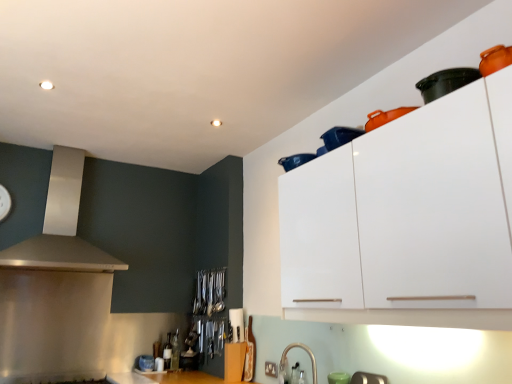
This screenshot has height=384, width=512. I want to click on metallic silver gas stove at lower left, so click(58, 378).

Measure the distance between point (316, 371) and camera.

The distance of point (316, 371) from camera is 2.32 meters.

Where is `polished stainless steel cutlery at center`? polished stainless steel cutlery at center is located at coordinates (209, 292).

What is the approximate height of satin silver vent at upper left?

satin silver vent at upper left is 35.42 inches tall.

Identify the location of white plastic knife block at center, arranged as the first appliance when ordered from the bottom. (237, 324).

At what (x,y) coordinates should I click in order to perform the action: click on metallic silver gas stove at lower left. Please return your answer as a coordinate pair (x, y). The width and height of the screenshot is (512, 384). Looking at the image, I should click on (58, 378).

Is point (281, 360) more distant than point (364, 131)?

Yes.

Which object is wider, satin nickel faucet at lower center, the second appliance positioned from the back, or blue plastic container at upper center, marked as the third appliance in a left-to-right arrangement?

blue plastic container at upper center, marked as the third appliance in a left-to-right arrangement.

Is satin nickel faucet at lower center, the 2th appliance in the top-to-bottom sequence, with blue plastic container at upper center, which is the first appliance in right-to-left order?

No, satin nickel faucet at lower center, the 2th appliance in the top-to-bottom sequence, is not in contact with blue plastic container at upper center, which is the first appliance in right-to-left order.

Consider the image. From the image's perspective, is satin nickel faucet at lower center, which is counted as the second appliance, starting from the left, located above or below blue plastic container at upper center, which is the first appliance in right-to-left order?

Based on their image positions, satin nickel faucet at lower center, which is counted as the second appliance, starting from the left, is located beneath blue plastic container at upper center, which is the first appliance in right-to-left order.

Is satin nickel faucet at lower center, the second appliance positioned from the back, far away from white glossy cabinet at upper right?

Indeed, satin nickel faucet at lower center, the second appliance positioned from the back, is not near white glossy cabinet at upper right.

From a real-world perspective, who is located lower, satin nickel faucet at lower center, the second appliance when ordered from right to left, or white glossy cabinet at upper right?

In real-world perspective, satin nickel faucet at lower center, the second appliance when ordered from right to left, is lower.

Which object is further away from the camera, satin nickel faucet at lower center, the second appliance positioned from the back, or white glossy cabinet at upper right?

Positioned behind is satin nickel faucet at lower center, the second appliance positioned from the back.

Where is `appliance that is the 2nd one when counting backward from the white glossy cabinet at upper right`? Image resolution: width=512 pixels, height=384 pixels. appliance that is the 2nd one when counting backward from the white glossy cabinet at upper right is located at coordinates (308, 354).

How many degrees apart are the facing directions of white glossy cabinet at upper right and satin silver vent at upper left?

89.8 degrees separate the facing orientations of white glossy cabinet at upper right and satin silver vent at upper left.

Is white glossy cabinet at upper right oriented away from satin silver vent at upper left?

No, white glossy cabinet at upper right is not facing away from satin silver vent at upper left.

Considering the relative sizes of white glossy cabinet at upper right and satin silver vent at upper left in the image provided, is white glossy cabinet at upper right shorter than satin silver vent at upper left?

Indeed, white glossy cabinet at upper right has a lesser height compared to satin silver vent at upper left.

Considering the sizes of objects white glossy cabinet at upper right and satin silver vent at upper left in the image provided, who is thinner, white glossy cabinet at upper right or satin silver vent at upper left?

white glossy cabinet at upper right is thinner.

Is white glossy cabinet at upper right wider than metallic silver gas stove at lower left?

No, white glossy cabinet at upper right is not wider than metallic silver gas stove at lower left.

Which object is closer to the camera, white glossy cabinet at upper right or metallic silver gas stove at lower left?

white glossy cabinet at upper right.

Could you tell me if white glossy cabinet at upper right is facing metallic silver gas stove at lower left?

No, white glossy cabinet at upper right does not turn towards metallic silver gas stove at lower left.

Is white glossy cabinet at upper right surrounding metallic silver gas stove at lower left?

No, white glossy cabinet at upper right does not contain metallic silver gas stove at lower left.

Based on the photo, can you confirm if blue plastic container at upper center, marked as the third appliance in a left-to-right arrangement, is shorter than satin silver vent at upper left?

Yes, blue plastic container at upper center, marked as the third appliance in a left-to-right arrangement, is shorter than satin silver vent at upper left.

Consider the image. Is blue plastic container at upper center, the 3th appliance in the back-to-front sequence, bigger than satin silver vent at upper left?

No.

Based on the photo, from the image's perspective, which is above, blue plastic container at upper center, the first appliance when ordered from front to back, or satin silver vent at upper left?

blue plastic container at upper center, the first appliance when ordered from front to back, appears higher in the image.

Is polished stainless steel cutlery at center not within blue plastic container at upper center, the 3th appliance in the back-to-front sequence?

Yes.

Is polished stainless steel cutlery at center to the left of blue plastic container at upper center, the first appliance when ordered from front to back, from the viewer's perspective?

Yes.

Is point (213, 297) farther from camera compared to point (359, 134)?

Yes, it is.

Can you confirm if polished stainless steel cutlery at center is shorter than blue plastic container at upper center, which is the first appliance in right-to-left order?

No, polished stainless steel cutlery at center is not shorter than blue plastic container at upper center, which is the first appliance in right-to-left order.

From the image's perspective, who appears lower, satin silver vent at upper left or white plastic knife block at center, arranged as the first appliance when ordered from the bottom?

white plastic knife block at center, arranged as the first appliance when ordered from the bottom, appears lower in the image.

Looking at this image, which of these two, satin silver vent at upper left or white plastic knife block at center, acting as the 3th appliance starting from the front, is wider?

With larger width is satin silver vent at upper left.

Consider the image. Can you confirm if satin silver vent at upper left is positioned to the left of white plastic knife block at center, marked as the 3th appliance in a top-to-bottom arrangement?

Yes, satin silver vent at upper left is to the left of white plastic knife block at center, marked as the 3th appliance in a top-to-bottom arrangement.

Find the location of a particular element. This screenshot has width=512, height=384. the 2nd appliance below the blue plastic container at upper center, the third appliance ordered from the bottom (from a real-world perspective) is located at coordinates (308, 354).

You are a GUI agent. You are given a task and a screenshot of the screen. Output one action in this format:
    pyautogui.click(x=<x>, y=<y>)
    Task: Click on the cabinetry on the right of satin nickel faucet at lower center, the second appliance positioned from the back
    The height and width of the screenshot is (384, 512).
    Given the screenshot: What is the action you would take?
    pyautogui.click(x=407, y=219)

When comparing their distances from satin nickel faucet at lower center, which is counted as the second appliance, starting from the left, does white glossy cabinet at upper right or satin silver vent at upper left seem closer?

white glossy cabinet at upper right.

When comparing their distances from metallic silver gas stove at lower left, does satin nickel faucet at lower center, the second appliance positioned from the back, or white plastic knife block at center, the 1th appliance from the left, seem closer?

white plastic knife block at center, the 1th appliance from the left.

Looking at the image, which one is located closer to white glossy cabinet at upper right, polished stainless steel cutlery at center or satin nickel faucet at lower center, placed as the second appliance when sorted from bottom to top?

satin nickel faucet at lower center, placed as the second appliance when sorted from bottom to top, lies closer to white glossy cabinet at upper right than the other object.

Looking at the image, which one is located closer to polished stainless steel cutlery at center, white glossy cabinet at upper right or white plastic knife block at center, marked as the 3th appliance in a top-to-bottom arrangement?

Among the two, white plastic knife block at center, marked as the 3th appliance in a top-to-bottom arrangement, is located nearer to polished stainless steel cutlery at center.

Looking at the image, which one is located closer to metallic silver gas stove at lower left, white plastic knife block at center, which ranks as the 1th appliance in back-to-front order, or blue plastic container at upper center, marked as the third appliance in a left-to-right arrangement?

white plastic knife block at center, which ranks as the 1th appliance in back-to-front order.

When comparing their distances from white glossy cabinet at upper right, does polished stainless steel cutlery at center or white plastic knife block at center, which ranks as the 1th appliance in back-to-front order, seem closer?

white plastic knife block at center, which ranks as the 1th appliance in back-to-front order, is closer to white glossy cabinet at upper right.

Which object lies nearer to the anchor point satin silver vent at upper left, white glossy cabinet at upper right or white plastic knife block at center, which ranks as the 1th appliance in back-to-front order?

The object closer to satin silver vent at upper left is white plastic knife block at center, which ranks as the 1th appliance in back-to-front order.

Which object lies further to the anchor point white plastic knife block at center, the 1th appliance from the left, satin nickel faucet at lower center, which is the second appliance from front to back, or satin silver vent at upper left?

satin silver vent at upper left is positioned further to the anchor white plastic knife block at center, the 1th appliance from the left.

Image resolution: width=512 pixels, height=384 pixels. Find the location of `silverware between satin silver vent at upper left and satin nickel faucet at lower center, the 2th appliance in the top-to-bottom sequence`. silverware between satin silver vent at upper left and satin nickel faucet at lower center, the 2th appliance in the top-to-bottom sequence is located at coordinates (209, 292).

Find the location of a particular element. The image size is (512, 384). silverware between metallic silver gas stove at lower left and satin nickel faucet at lower center, which is counted as the second appliance, starting from the left is located at coordinates (209, 292).

The width and height of the screenshot is (512, 384). I want to click on silverware between satin silver vent at upper left and metallic silver gas stove at lower left from top to bottom, so click(x=209, y=292).

Image resolution: width=512 pixels, height=384 pixels. I want to click on appliance between metallic silver gas stove at lower left and satin nickel faucet at lower center, the 2th appliance in the top-to-bottom sequence, in the horizontal direction, so click(x=237, y=324).